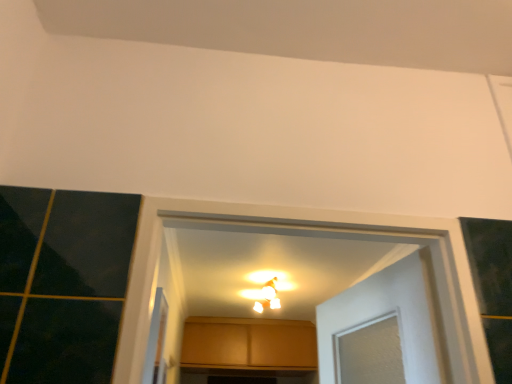
Question: Considering the relative sizes of clear plastic screen door at lower left and matte wood cabinet at center in the image provided, is clear plastic screen door at lower left taller than matte wood cabinet at center?

Choices:
 (A) yes
 (B) no

Answer: (B)

Question: Can you see clear plastic screen door at lower left touching matte wood cabinet at center?

Choices:
 (A) no
 (B) yes

Answer: (A)

Question: Could you tell me if clear plastic screen door at lower left is facing matte wood cabinet at center?

Choices:
 (A) yes
 (B) no

Answer: (B)

Question: Is clear plastic screen door at lower left thinner than matte wood cabinet at center?

Choices:
 (A) yes
 (B) no

Answer: (A)

Question: Does clear plastic screen door at lower left have a larger size compared to matte wood cabinet at center?

Choices:
 (A) no
 (B) yes

Answer: (A)

Question: Does point (292, 339) appear closer or farther from the camera than point (275, 299)?

Choices:
 (A) farther
 (B) closer

Answer: (A)

Question: Based on their sizes in the image, would you say matte wood cabinet at center is bigger or smaller than matte white light fixture at center?

Choices:
 (A) big
 (B) small

Answer: (A)

Question: Is matte wood cabinet at center taller or shorter than matte white light fixture at center?

Choices:
 (A) short
 (B) tall

Answer: (B)

Question: From the image's perspective, is matte wood cabinet at center positioned above or below matte white light fixture at center?

Choices:
 (A) below
 (B) above

Answer: (A)

Question: Is clear plastic screen door at lower left situated inside matte wood cabinet at center or outside?

Choices:
 (A) inside
 (B) outside

Answer: (B)

Question: Is point (150, 382) positioned closer to the camera than point (200, 332)?

Choices:
 (A) farther
 (B) closer

Answer: (B)

Question: From a real-world perspective, is clear plastic screen door at lower left physically located above or below matte wood cabinet at center?

Choices:
 (A) below
 (B) above

Answer: (A)

Question: Looking at their shapes, would you say clear plastic screen door at lower left is wider or thinner than matte wood cabinet at center?

Choices:
 (A) wide
 (B) thin

Answer: (B)

Question: Looking at the image, does matte wood cabinet at center seem bigger or smaller compared to clear plastic screen door at lower left?

Choices:
 (A) big
 (B) small

Answer: (A)

Question: In terms of width, does matte wood cabinet at center look wider or thinner when compared to clear plastic screen door at lower left?

Choices:
 (A) wide
 (B) thin

Answer: (A)